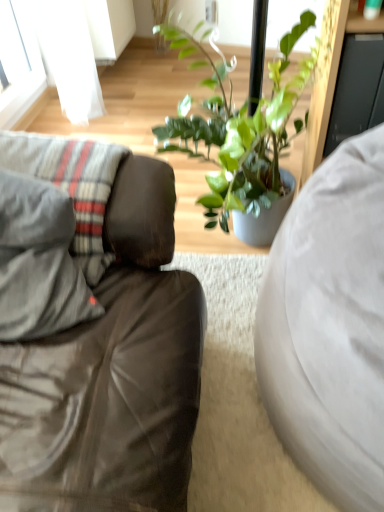
Question: Considering the relative sizes of white fabric studio couch at right, which is counted as the second studio couch, starting from the left, and matte gray couch at left, the first studio couch positioned from the left, in the image provided, is white fabric studio couch at right, which is counted as the second studio couch, starting from the left, smaller than matte gray couch at left, the first studio couch positioned from the left,?

Choices:
 (A) no
 (B) yes

Answer: (B)

Question: Is the surface of white fabric studio couch at right, which is counted as the second studio couch, starting from the left, in direct contact with matte gray couch at left, which appears as the 2th studio couch when viewed from the right?

Choices:
 (A) yes
 (B) no

Answer: (B)

Question: From a real-world perspective, is white fabric studio couch at right, which is the first studio couch in right-to-left order, on matte gray couch at left, the first studio couch positioned from the left?

Choices:
 (A) no
 (B) yes

Answer: (A)

Question: Are white fabric studio couch at right, which is counted as the second studio couch, starting from the left, and matte gray couch at left, which appears as the 2th studio couch when viewed from the right, located far from each other?

Choices:
 (A) no
 (B) yes

Answer: (A)

Question: Is white fabric studio couch at right, which is counted as the second studio couch, starting from the left, surrounding matte gray couch at left, the first studio couch positioned from the left?

Choices:
 (A) no
 (B) yes

Answer: (A)

Question: Relative to white fabric studio couch at right, which is the first studio couch in right-to-left order, is matte gray couch at left, the first studio couch positioned from the left, in front or behind?

Choices:
 (A) front
 (B) behind

Answer: (A)

Question: Considering the positions of matte gray couch at left, which appears as the 2th studio couch when viewed from the right, and white fabric studio couch at right, which is the first studio couch in right-to-left order, in the image, is matte gray couch at left, which appears as the 2th studio couch when viewed from the right, taller or shorter than white fabric studio couch at right, which is the first studio couch in right-to-left order,?

Choices:
 (A) tall
 (B) short

Answer: (A)

Question: Based on their sizes in the image, would you say matte gray couch at left, which appears as the 2th studio couch when viewed from the right, is bigger or smaller than white fabric studio couch at right, which is counted as the second studio couch, starting from the left?

Choices:
 (A) small
 (B) big

Answer: (B)

Question: Is matte gray couch at left, the first studio couch positioned from the left, inside or outside of white fabric studio couch at right, which is counted as the second studio couch, starting from the left?

Choices:
 (A) outside
 (B) inside

Answer: (A)

Question: Is gray fabric pillow at left to the left or to the right of matte gray couch at left, which appears as the 2th studio couch when viewed from the right, in the image?

Choices:
 (A) left
 (B) right

Answer: (A)

Question: Considering the positions of gray fabric pillow at left and matte gray couch at left, the first studio couch positioned from the left, in the image, is gray fabric pillow at left bigger or smaller than matte gray couch at left, the first studio couch positioned from the left,?

Choices:
 (A) small
 (B) big

Answer: (A)

Question: From a real-world perspective, is gray fabric pillow at left positioned above or below matte gray couch at left, which appears as the 2th studio couch when viewed from the right?

Choices:
 (A) above
 (B) below

Answer: (A)

Question: Choose the correct answer: Is gray fabric pillow at left inside matte gray couch at left, which appears as the 2th studio couch when viewed from the right, or outside it?

Choices:
 (A) outside
 (B) inside

Answer: (B)

Question: Do you think gray fabric pillow at left is within white fabric studio couch at right, which is the first studio couch in right-to-left order, or outside of it?

Choices:
 (A) inside
 (B) outside

Answer: (B)

Question: Is gray fabric pillow at left taller or shorter than white fabric studio couch at right, which is counted as the second studio couch, starting from the left?

Choices:
 (A) short
 (B) tall

Answer: (A)